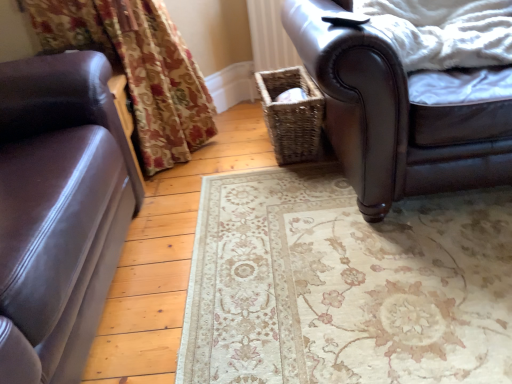
Question: From a real-world perspective, is white fluffy blanket at upper right positioned above or below brown leather chair at upper right?

Choices:
 (A) above
 (B) below

Answer: (A)

Question: In the image, is white fluffy blanket at upper right positioned in front of or behind brown leather chair at upper right?

Choices:
 (A) front
 (B) behind

Answer: (B)

Question: Based on their relative distances, which object is farther from the white fluffy blanket at upper right?

Choices:
 (A) woven brown basket at center
 (B) matte brown leather couch at left
 (C) brown leather chair at upper right

Answer: (B)

Question: Which of these objects is positioned farthest from the white fluffy blanket at upper right?

Choices:
 (A) brown leather chair at upper right
 (B) woven brown basket at center
 (C) matte brown leather couch at left

Answer: (C)